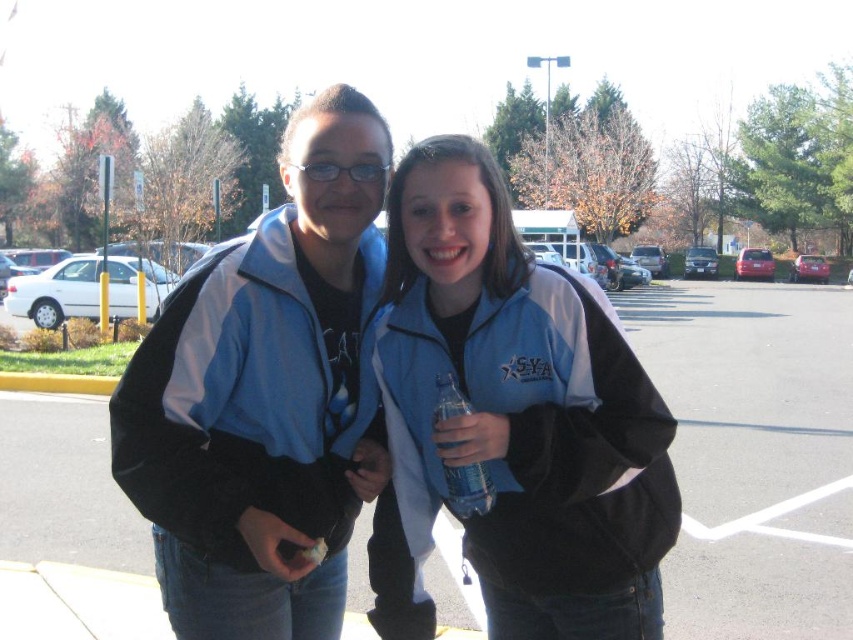
You are a photographer trying to capture a photo of the blue fleece jacket at center and the clear plastic water bottle at center. Which object should you focus on first if you want to ensure both are in focus without moving the camera?

The blue fleece jacket at center is above the clear plastic water bottle at center, so focusing on the blue fleece jacket at center first will ensure both are in focus since it is closer to the camera.

You are standing in the parking lot and see the point at coordinates (755, 452). Which object from the scene does this point lie on?

The point at coordinates (755, 452) lies on the matte blue jacket at center.

You are trying to decide which jacket to wear for a walk in the park. Both jackets are in front of you at the center. The blue fleece jacket at center and the matte blue jacket at center. Based on their sizes, which one would you choose if you prefer a longer jacket?

The blue fleece jacket at center has a greater height compared to the matte blue jacket at center, so you should choose the blue fleece jacket at center if you prefer a longer jacket.